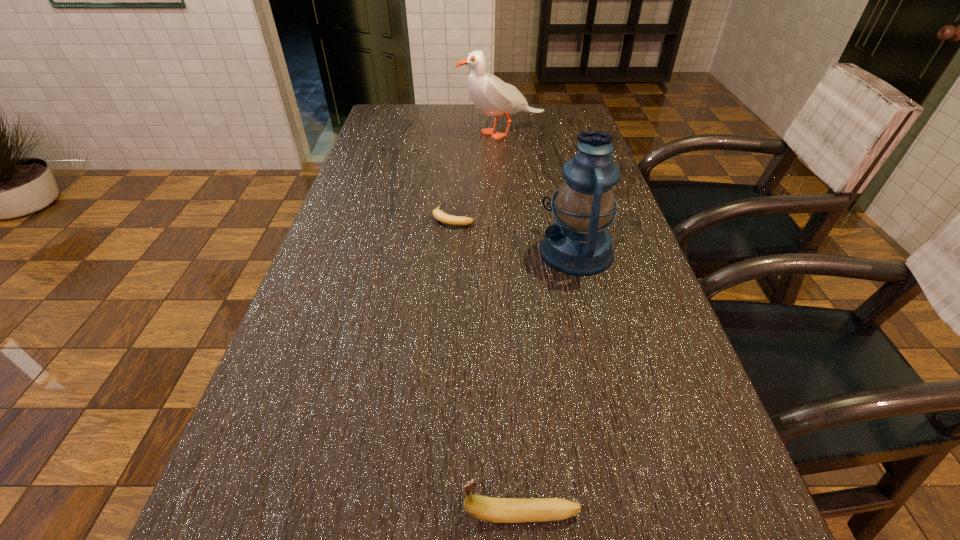
Locate an element on the screen. lantern is located at coordinates (578, 243).

In order to click on gull in this screenshot , I will do [x=492, y=96].

You are a GUI agent. You are given a task and a screenshot of the screen. Output one action in this format:
    pyautogui.click(x=<x>, y=<y>)
    Task: Click on the third tallest object
    The image size is (960, 540).
    Given the screenshot: What is the action you would take?
    pyautogui.click(x=491, y=509)

Image resolution: width=960 pixels, height=540 pixels. I want to click on the nearer banana, so click(x=491, y=509).

The image size is (960, 540). I want to click on the shorter banana, so click(x=438, y=214).

Image resolution: width=960 pixels, height=540 pixels. I want to click on the shortest object, so click(438, 214).

You are a GUI agent. You are given a task and a screenshot of the screen. Output one action in this format:
    pyautogui.click(x=<x>, y=<y>)
    Task: Click on the free region located on the face of the lantern
    
    Given the screenshot: What is the action you would take?
    pyautogui.click(x=471, y=251)

The width and height of the screenshot is (960, 540). Identify the location of blank space located on the face of the lantern. (378, 251).

Find the location of a particular element. vacant area situated 0.090m on the face of the lantern is located at coordinates (501, 251).

At what (x,y) coordinates should I click in order to perform the action: click on free space located at the beak of the gull. Please return your answer as a coordinate pair (x, y). Looking at the image, I should click on (433, 133).